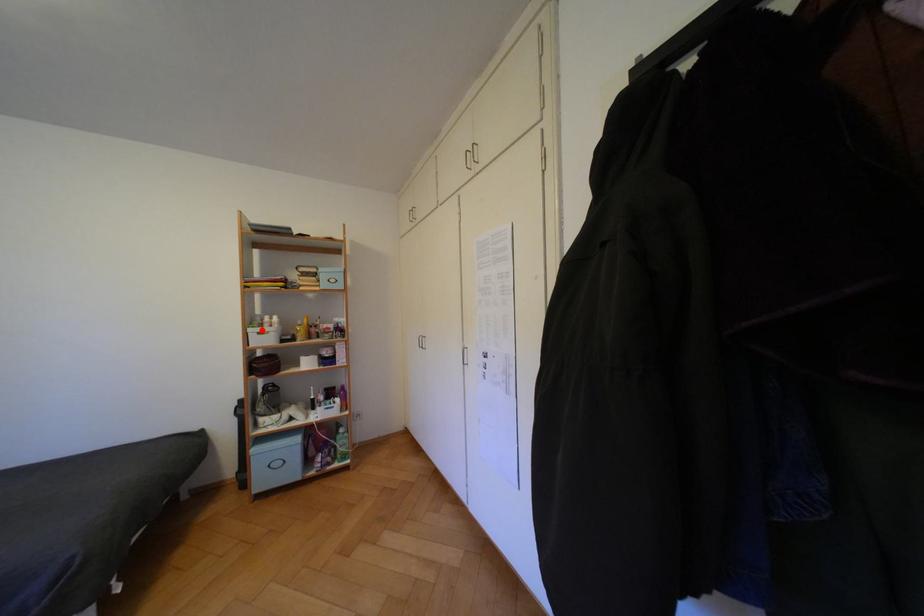
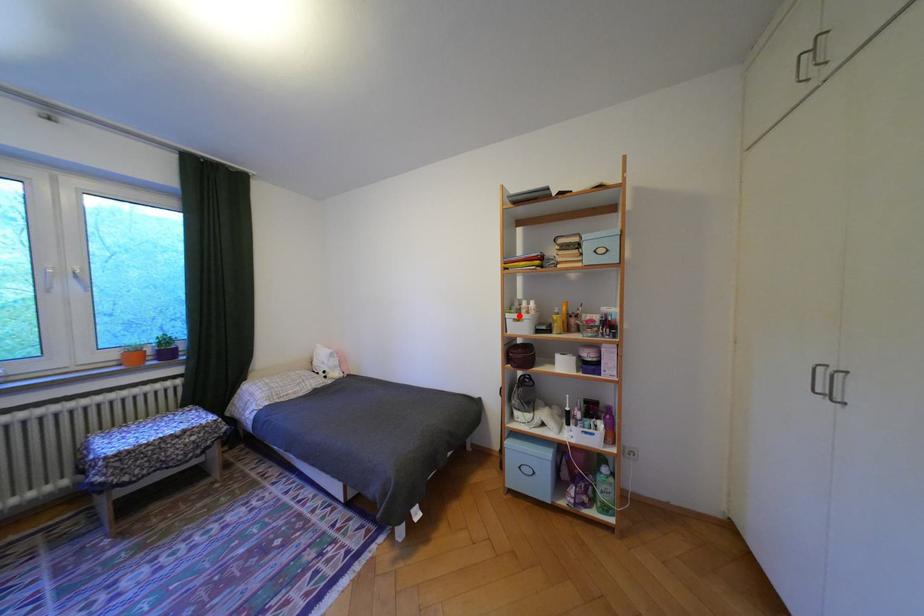
I am providing you with two images of the same scene from different viewpoints. A red point is marked on the first image and another point is marked on the second image. Does the point marked in image1 correspond to the same location as the one in image2?

Yes